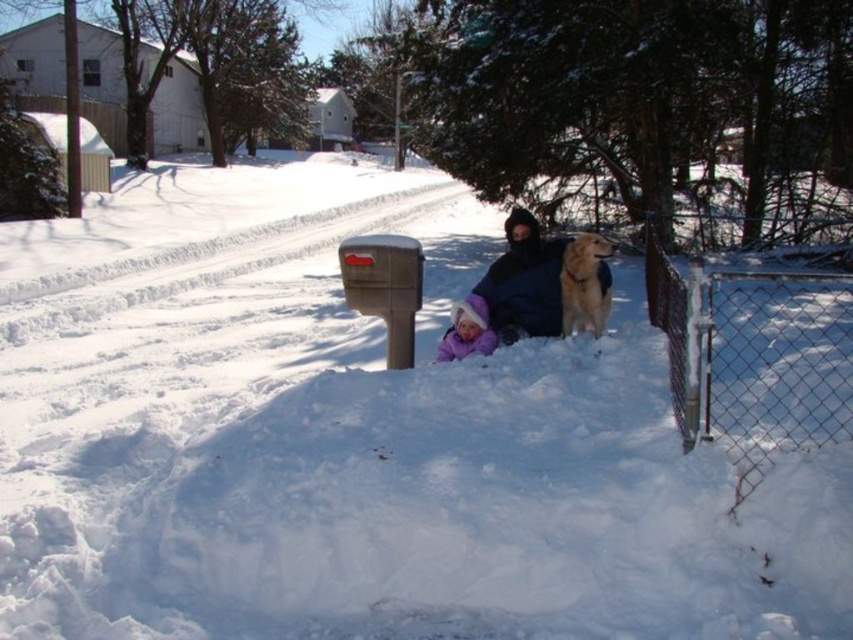
Can you confirm if chain-link fence at lower right is positioned below purple fleece hat at lower center?

No.

Which is behind, point (722, 314) or point (454, 339)?

Point (722, 314)

The width and height of the screenshot is (853, 640). Find the location of `chain-link fence at lower right`. chain-link fence at lower right is located at coordinates (752, 356).

Can you confirm if dark blue jacket at center is thinner than purple fleece hat at lower center?

No, dark blue jacket at center is not thinner than purple fleece hat at lower center.

Is point (538, 250) behind point (474, 321)?

Yes, point (538, 250) is behind point (474, 321).

Who is more distant from viewer, (498, 337) or (463, 339)?

Point (498, 337)

I want to click on dark blue jacket at center, so click(x=524, y=282).

Does gray plastic mailbox at center appear on the left side of purple fleece hat at lower center?

Indeed, gray plastic mailbox at center is positioned on the left side of purple fleece hat at lower center.

In the scene shown: Can you confirm if gray plastic mailbox at center is wider than purple fleece hat at lower center?

Yes.

Is point (374, 243) closer to viewer compared to point (445, 349)?

Yes, it is.

You are a GUI agent. You are given a task and a screenshot of the screen. Output one action in this format:
    pyautogui.click(x=<x>, y=<y>)
    Task: Click on the gray plastic mailbox at center
    The image size is (853, 640).
    Given the screenshot: What is the action you would take?
    point(386,285)